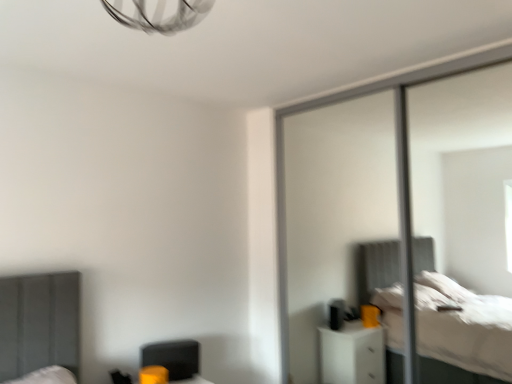
Question: Is matte black swivel chair at lower left shorter than transparent glass screen door at right?

Choices:
 (A) yes
 (B) no

Answer: (A)

Question: Is matte black swivel chair at lower left facing towards transparent glass screen door at right?

Choices:
 (A) yes
 (B) no

Answer: (B)

Question: From the image's perspective, is matte black swivel chair at lower left beneath transparent glass screen door at right?

Choices:
 (A) yes
 (B) no

Answer: (A)

Question: Can you confirm if matte black swivel chair at lower left is thinner than transparent glass screen door at right?

Choices:
 (A) no
 (B) yes

Answer: (B)

Question: Can we say matte black swivel chair at lower left lies outside transparent glass screen door at right?

Choices:
 (A) yes
 (B) no

Answer: (A)

Question: From a real-world perspective, is matte black swivel chair at lower left on transparent glass screen door at right?

Choices:
 (A) yes
 (B) no

Answer: (B)

Question: Is transparent glass screen door at right to the left of matte black swivel chair at lower left from the viewer's perspective?

Choices:
 (A) yes
 (B) no

Answer: (B)

Question: Would you say transparent glass screen door at right is outside matte black swivel chair at lower left?

Choices:
 (A) yes
 (B) no

Answer: (A)

Question: From the image's perspective, would you say transparent glass screen door at right is positioned over matte black swivel chair at lower left?

Choices:
 (A) no
 (B) yes

Answer: (B)

Question: From a real-world perspective, is transparent glass screen door at right located beneath matte black swivel chair at lower left?

Choices:
 (A) no
 (B) yes

Answer: (A)

Question: Considering the relative sizes of transparent glass screen door at right and matte black swivel chair at lower left in the image provided, is transparent glass screen door at right smaller than matte black swivel chair at lower left?

Choices:
 (A) no
 (B) yes

Answer: (A)

Question: Does transparent glass screen door at right have a lesser height compared to matte black swivel chair at lower left?

Choices:
 (A) no
 (B) yes

Answer: (A)

Question: Considering the positions of transparent glass screen door at right and matte black swivel chair at lower left in the image, is transparent glass screen door at right taller or shorter than matte black swivel chair at lower left?

Choices:
 (A) short
 (B) tall

Answer: (B)